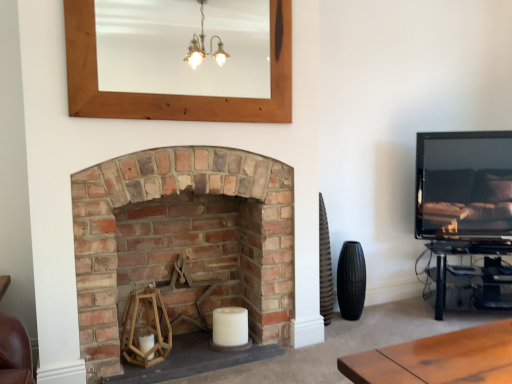
Question: From a real-world perspective, is wooden mirror at upper center positioned over matte black tv at right based on gravity?

Choices:
 (A) no
 (B) yes

Answer: (B)

Question: Is wooden mirror at upper center surrounding matte black tv at right?

Choices:
 (A) yes
 (B) no

Answer: (B)

Question: Does wooden mirror at upper center have a lesser height compared to matte black tv at right?

Choices:
 (A) no
 (B) yes

Answer: (B)

Question: Is wooden mirror at upper center positioned beyond the bounds of matte black tv at right?

Choices:
 (A) no
 (B) yes

Answer: (B)

Question: Does wooden mirror at upper center turn towards matte black tv at right?

Choices:
 (A) yes
 (B) no

Answer: (B)

Question: Can you confirm if wooden mirror at upper center is positioned to the right of matte black tv at right?

Choices:
 (A) yes
 (B) no

Answer: (B)

Question: From a real-world perspective, does wooden mirror at upper center sit lower than rustic brick fireplace at center?

Choices:
 (A) no
 (B) yes

Answer: (A)

Question: Can you confirm if wooden mirror at upper center is thinner than rustic brick fireplace at center?

Choices:
 (A) yes
 (B) no

Answer: (A)

Question: From a real-world perspective, is wooden mirror at upper center located higher than rustic brick fireplace at center?

Choices:
 (A) no
 (B) yes

Answer: (B)

Question: Is rustic brick fireplace at center completely or partially inside wooden mirror at upper center?

Choices:
 (A) yes
 (B) no

Answer: (B)

Question: Considering the relative positions of wooden mirror at upper center and rustic brick fireplace at center in the image provided, is wooden mirror at upper center to the right of rustic brick fireplace at center from the viewer's perspective?

Choices:
 (A) no
 (B) yes

Answer: (B)

Question: Is wooden mirror at upper center far away from rustic brick fireplace at center?

Choices:
 (A) yes
 (B) no

Answer: (B)

Question: From a real-world perspective, is rustic brick fireplace at center below matte black tv at right?

Choices:
 (A) no
 (B) yes

Answer: (B)